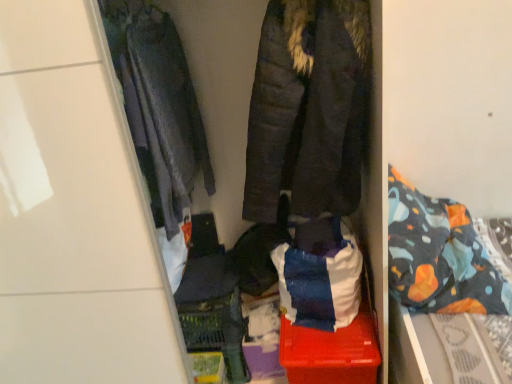
Question: Can you confirm if dark brown quilted jacket at center, the 2th jacket when ordered from left to right, is bigger than dark gray quilted jacket at left, the 1th jacket in the left-to-right sequence?

Choices:
 (A) no
 (B) yes

Answer: (B)

Question: Would you say dark brown quilted jacket at center, the 2th jacket when ordered from left to right, is outside dark gray quilted jacket at left, the 1th jacket in the left-to-right sequence?

Choices:
 (A) no
 (B) yes

Answer: (B)

Question: Is dark brown quilted jacket at center, positioned as the 1th jacket in right-to-left order, at the right side of dark gray quilted jacket at left, which appears as the second jacket when viewed from the right?

Choices:
 (A) no
 (B) yes

Answer: (B)

Question: Can you confirm if dark brown quilted jacket at center, positioned as the 1th jacket in right-to-left order, is wider than dark gray quilted jacket at left, the 1th jacket in the left-to-right sequence?

Choices:
 (A) no
 (B) yes

Answer: (B)

Question: Is dark brown quilted jacket at center, positioned as the 1th jacket in right-to-left order, thinner than dark gray quilted jacket at left, which appears as the second jacket when viewed from the right?

Choices:
 (A) yes
 (B) no

Answer: (B)

Question: Can you see dark brown quilted jacket at center, the 2th jacket when ordered from left to right, touching dark gray quilted jacket at left, which appears as the second jacket when viewed from the right?

Choices:
 (A) no
 (B) yes

Answer: (A)

Question: From the image's perspective, is patterned fabric bed at right on dark gray quilted jacket at left, the 1th jacket in the left-to-right sequence?

Choices:
 (A) no
 (B) yes

Answer: (A)

Question: Can you confirm if patterned fabric bed at right is positioned to the right of dark gray quilted jacket at left, the 1th jacket in the left-to-right sequence?

Choices:
 (A) no
 (B) yes

Answer: (B)

Question: From a real-world perspective, is patterned fabric bed at right on top of dark gray quilted jacket at left, which appears as the second jacket when viewed from the right?

Choices:
 (A) yes
 (B) no

Answer: (B)

Question: Is patterned fabric bed at right looking in the opposite direction of dark gray quilted jacket at left, which appears as the second jacket when viewed from the right?

Choices:
 (A) yes
 (B) no

Answer: (A)

Question: Can you confirm if patterned fabric bed at right is thinner than dark gray quilted jacket at left, which appears as the second jacket when viewed from the right?

Choices:
 (A) no
 (B) yes

Answer: (A)

Question: Is the position of patterned fabric bed at right more distant than that of dark gray quilted jacket at left, the 1th jacket in the left-to-right sequence?

Choices:
 (A) no
 (B) yes

Answer: (A)

Question: From a real-world perspective, is red plastic storage box at center physically above dark gray quilted jacket at left, the 1th jacket in the left-to-right sequence?

Choices:
 (A) yes
 (B) no

Answer: (B)